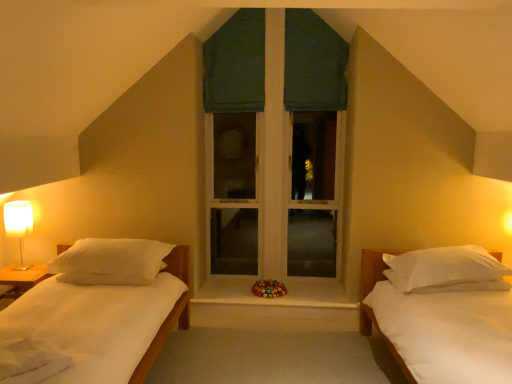
Question: Is dark green fabric at center, acting as the 2th curtain starting from the right, wider or thinner than wooden at center?

Choices:
 (A) wide
 (B) thin

Answer: (B)

Question: From the image's perspective, relative to wooden at center, is dark green fabric at center, the first curtain positioned from the left, above or below?

Choices:
 (A) above
 (B) below

Answer: (A)

Question: Considering the real-world distances, which object is closest to the dark green fabric at center, the first curtain positioned from the left?

Choices:
 (A) white fabric-covered lamp at left
 (B) green fabric curtain at upper center, which is the 2th curtain in left-to-right order
 (C) wooden at center
 (D) white matte bed at right
 (E) white soft pillow at right, which appears as the second pillow when viewed from the left

Answer: (B)

Question: Which object is the closest to the white matte bed at right?

Choices:
 (A) green fabric curtain at upper center, acting as the first curtain starting from the right
 (B) white soft pillow at right, placed as the first pillow when sorted from right to left
 (C) white fabric-covered lamp at left
 (D) wooden at center
 (E) white soft pillow at left, marked as the 1th pillow in a left-to-right arrangement

Answer: (B)